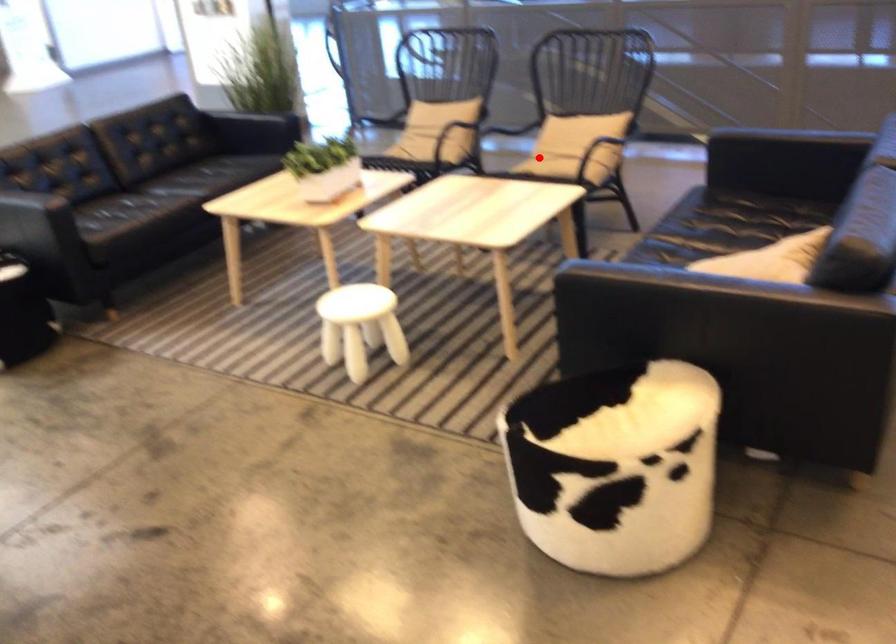
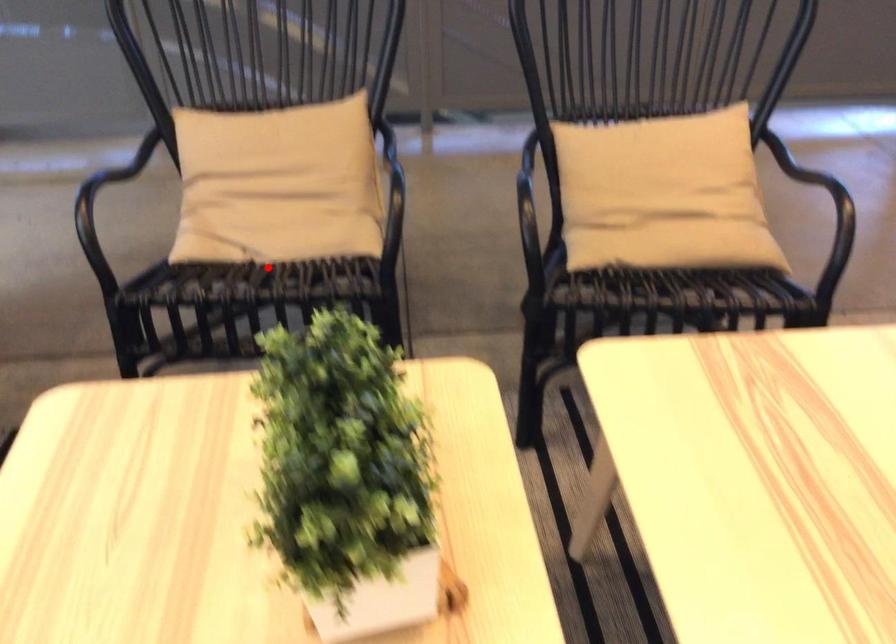
I am providing you with two images of the same scene from different viewpoints. A red point is marked on the first image and another point is marked on the second image. Are the points marked in image1 and image2 representing the same 3D position?

No